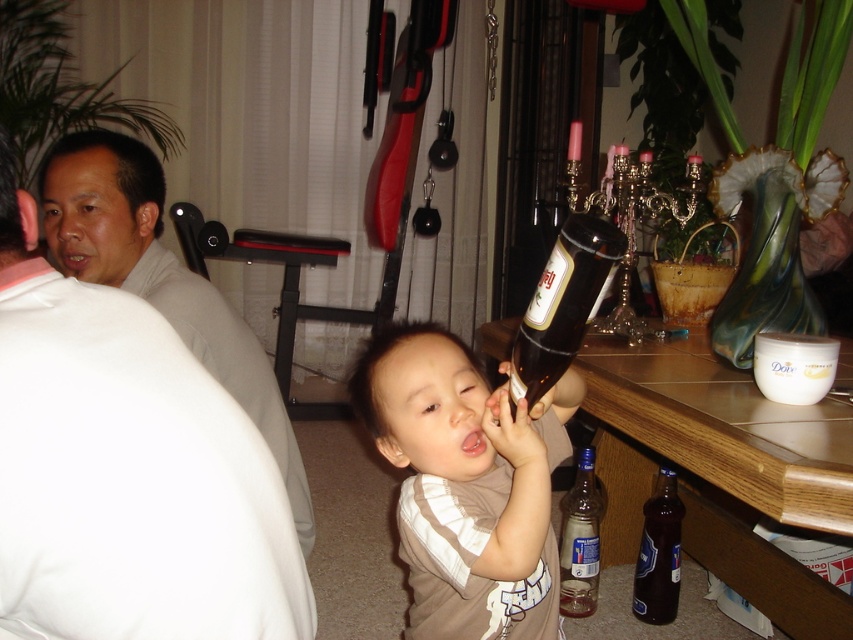
Question: From the image, what is the correct spatial relationship of brown striped shirt at center in relation to dark glass bottle at lower right?

Choices:
 (A) right
 (B) left

Answer: (B)

Question: Which object is closer to the camera taking this photo?

Choices:
 (A) brown striped shirt at center
 (B) brown glass bottle at center

Answer: (B)

Question: Is brown striped shirt at center below matte white shirt at left?

Choices:
 (A) yes
 (B) no

Answer: (A)

Question: Can you confirm if matte white shirt at left is wider than brown glass bottle at center?

Choices:
 (A) yes
 (B) no

Answer: (A)

Question: Which of these objects is positioned farthest from the brown striped shirt at center?

Choices:
 (A) matte white shirt at left
 (B) clear glass bottle at lower center
 (C) brown matte hair at center

Answer: (B)

Question: Which of the following is the farthest from the observer?

Choices:
 (A) (399, 515)
 (B) (67, 273)

Answer: (B)